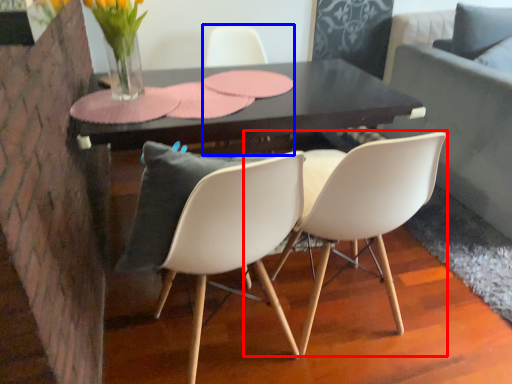
Question: Which of the following is the farthest to the observer, chair (highlighted by a red box) or chair (highlighted by a blue box)?

Choices:
 (A) chair
 (B) chair

Answer: (B)